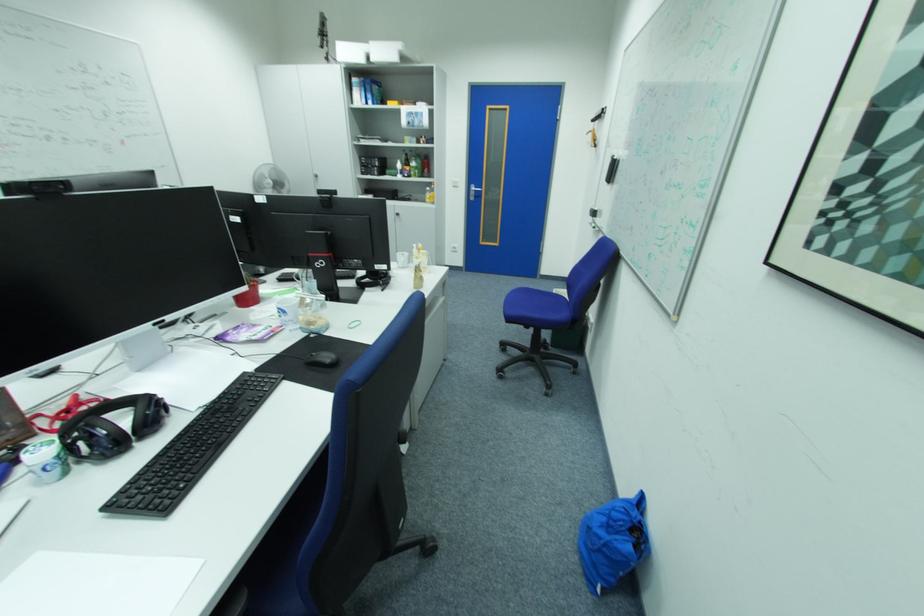
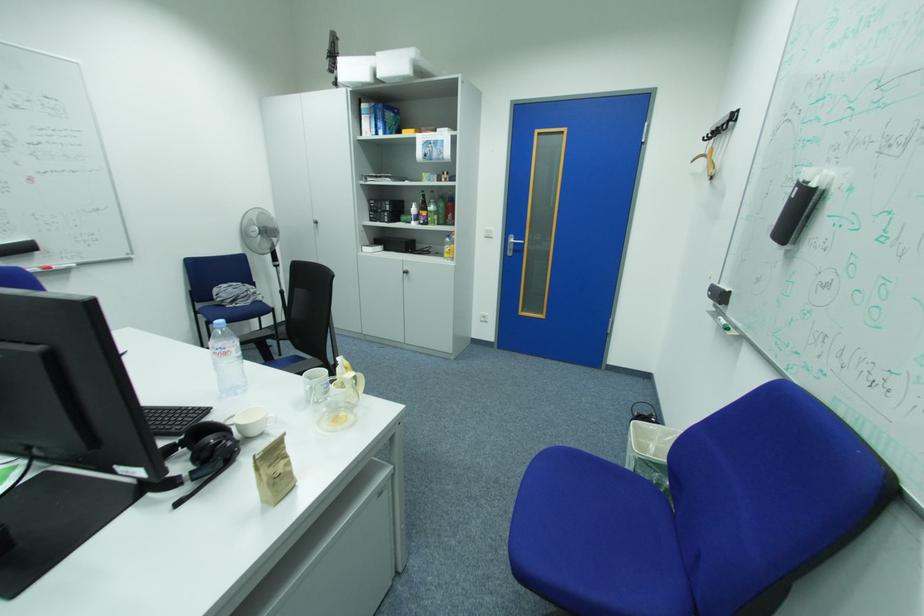
Question: The images are taken continuously from a first-person perspective. In which direction are you moving?

Choices:
 (A) Left
 (B) Right
 (C) Forward
 (D) Backward

Answer: (C)